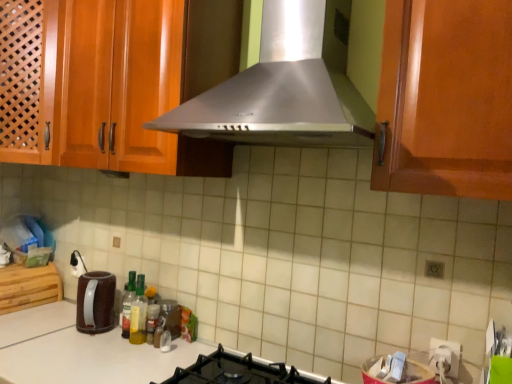
Question: Does wooden cutting board at lower left appear on the left side of black matte gas stove at lower center?

Choices:
 (A) no
 (B) yes

Answer: (B)

Question: Is black matte gas stove at lower center at the back of wooden cutting board at lower left?

Choices:
 (A) yes
 (B) no

Answer: (B)

Question: Is wooden cutting board at lower left closer to the viewer compared to black matte gas stove at lower center?

Choices:
 (A) yes
 (B) no

Answer: (B)

Question: Does wooden cutting board at lower left have a lesser height compared to black matte gas stove at lower center?

Choices:
 (A) yes
 (B) no

Answer: (B)

Question: Can you confirm if wooden cutting board at lower left is thinner than black matte gas stove at lower center?

Choices:
 (A) yes
 (B) no

Answer: (A)

Question: Would you say wooden cutting board at lower left is a long distance from black matte gas stove at lower center?

Choices:
 (A) no
 (B) yes

Answer: (B)

Question: Is translucent plastic bottle at center, the 1th bottle when ordered from right to left, completely or partially inside stainless steel range hood at center?

Choices:
 (A) no
 (B) yes

Answer: (A)

Question: Would you say stainless steel range hood at center is outside translucent plastic bottle at center, the 1th bottle when ordered from right to left?

Choices:
 (A) yes
 (B) no

Answer: (A)

Question: Considering the relative sizes of stainless steel range hood at center and translucent plastic bottle at center, the 1th bottle when ordered from right to left, in the image provided, is stainless steel range hood at center smaller than translucent plastic bottle at center, the 1th bottle when ordered from right to left,?

Choices:
 (A) yes
 (B) no

Answer: (B)

Question: Is stainless steel range hood at center at the left side of translucent plastic bottle at center, the 3th bottle in the left-to-right sequence?

Choices:
 (A) no
 (B) yes

Answer: (A)

Question: Considering the relative positions of stainless steel range hood at center and translucent plastic bottle at center, the 1th bottle when ordered from right to left, in the image provided, is stainless steel range hood at center to the right of translucent plastic bottle at center, the 1th bottle when ordered from right to left, from the viewer's perspective?

Choices:
 (A) no
 (B) yes

Answer: (B)

Question: Is stainless steel range hood at center oriented away from translucent plastic bottle at center, the 1th bottle when ordered from right to left?

Choices:
 (A) yes
 (B) no

Answer: (B)

Question: Could black matte gas stove at lower center be considered to be inside translucent plastic bottle at center, the 1th bottle when ordered from right to left?

Choices:
 (A) no
 (B) yes

Answer: (A)